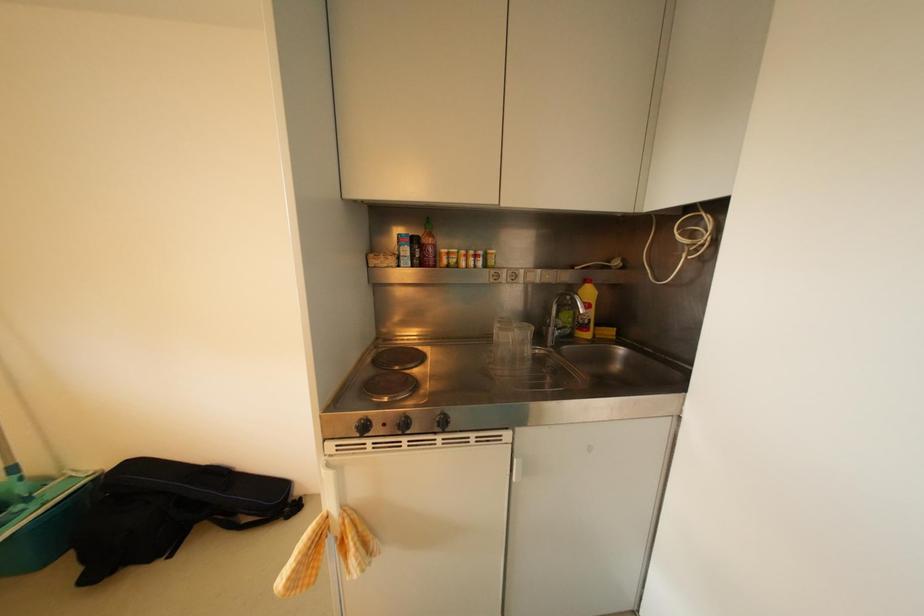
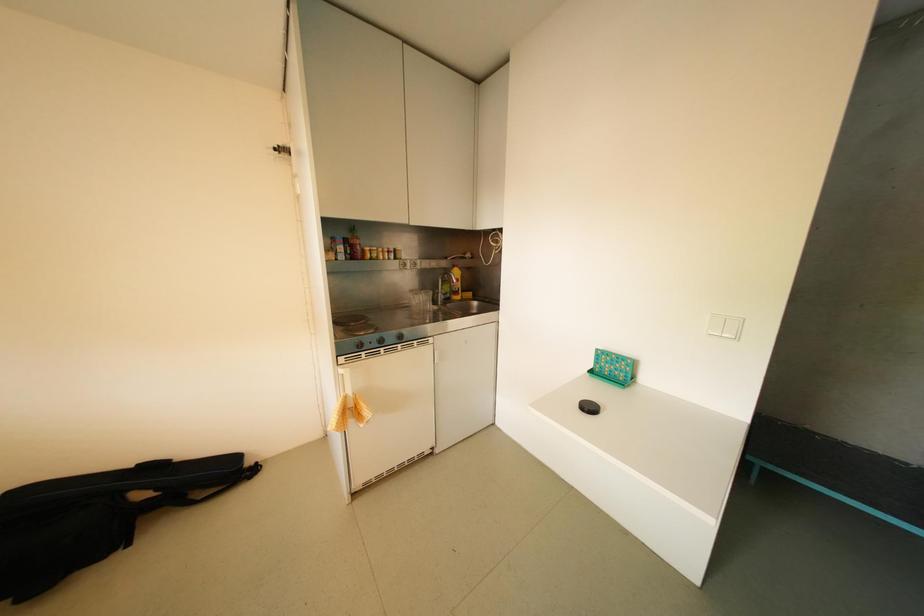
Question: The first image is from the beginning of the video and the second image is from the end. How did the camera likely rotate when shooting the video?

Choices:
 (A) Left
 (B) Right
 (C) Up
 (D) Down

Answer: (B)